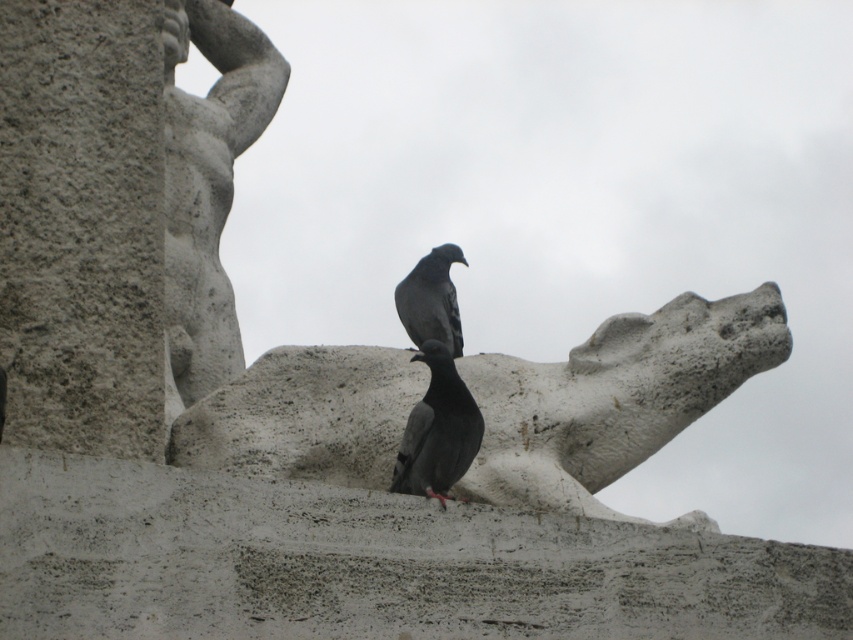
Question: Is gray matte pigeon at center positioned before matte gray pigeon at center?

Choices:
 (A) yes
 (B) no

Answer: (A)

Question: Where is gray stone gargoyle at center located in relation to gray matte pigeon at center in the image?

Choices:
 (A) below
 (B) above

Answer: (A)

Question: Which object appears farthest from the camera in this image?

Choices:
 (A) gray stone statue at upper left
 (B) gray stone gargoyle at center
 (C) gray matte pigeon at center

Answer: (A)

Question: Which point is closer to the camera?

Choices:
 (A) gray stone statue at upper left
 (B) matte gray pigeon at center
 (C) gray matte pigeon at center

Answer: (C)

Question: Does gray stone statue at upper left have a smaller size compared to matte gray pigeon at center?

Choices:
 (A) no
 (B) yes

Answer: (A)

Question: Estimate the real-world distances between objects in this image. Which object is closer to the gray stone statue at upper left?

Choices:
 (A) gray matte pigeon at center
 (B) gray stone gargoyle at center
 (C) matte gray pigeon at center

Answer: (C)